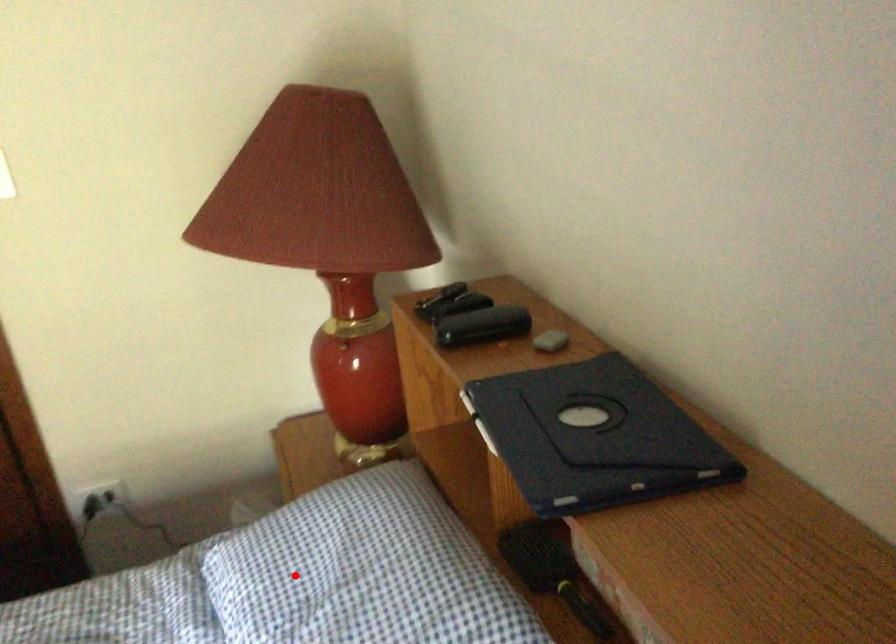
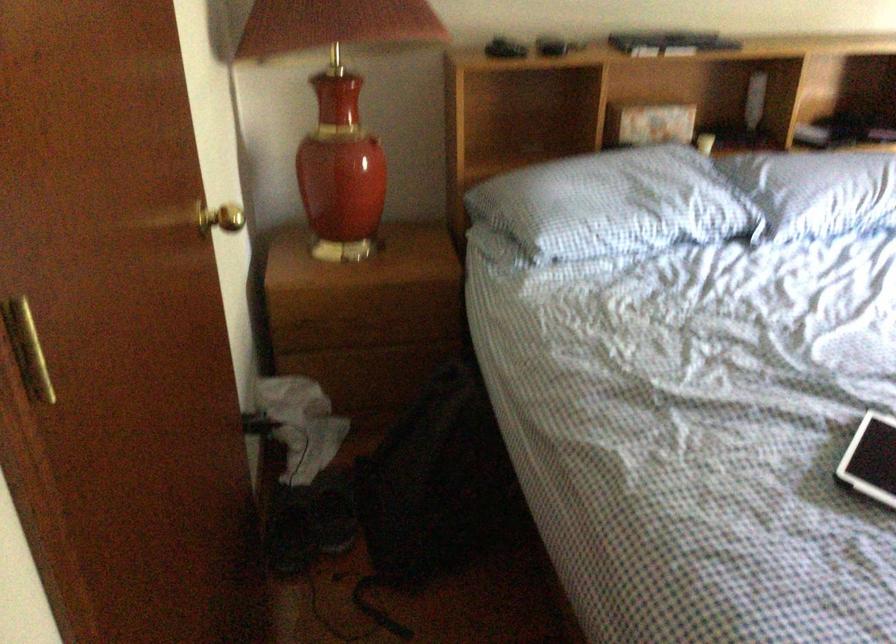
Where in the second image is the point corresponding to the highlighted location from the first image?

(613, 204)